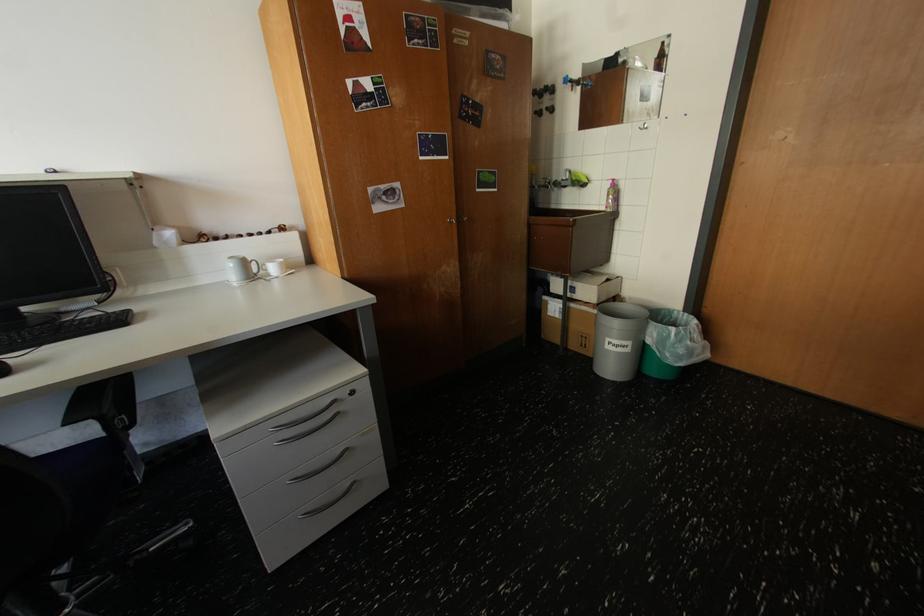
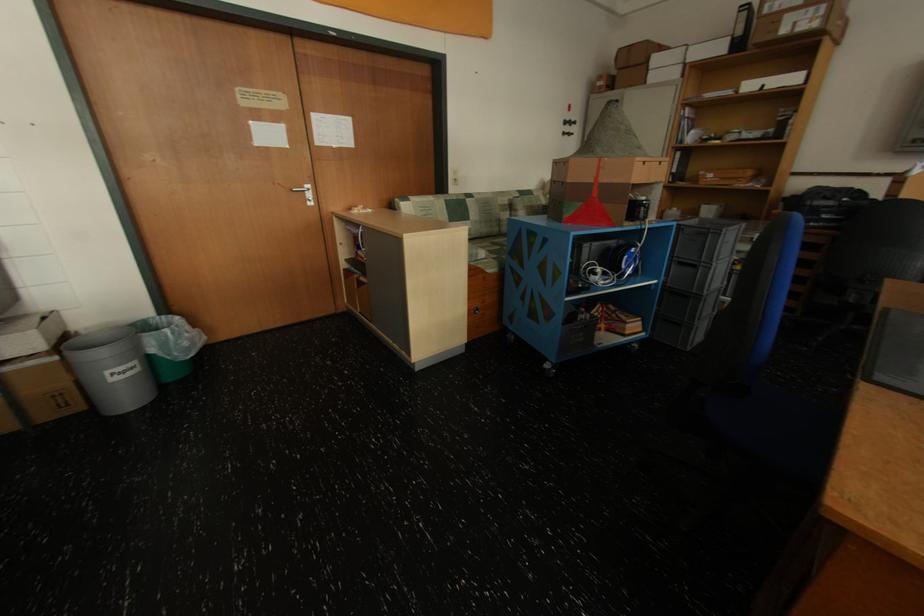
Locate, in the second image, the point that corresponds to point (603, 289) in the first image.

(43, 333)